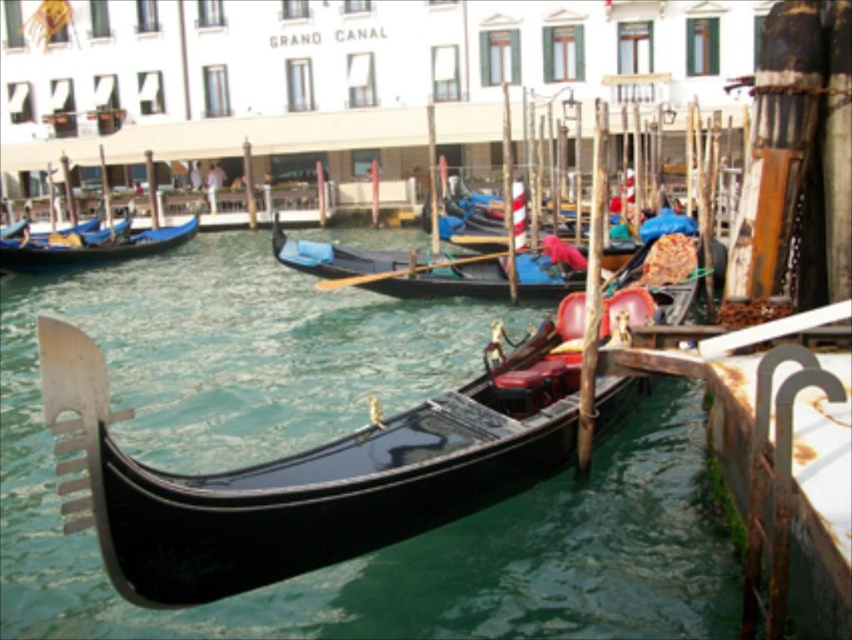
You are standing at the camera position and want to take a photo of the glossy black gondola at center. If your camera has a maximum focus range of 15 meters, will you be able to capture the gondola clearly?

The glossy black gondola at center and camera are 14.46 meters apart from each other, which is within the camera maximum focus range of 15 meters. Therefore, you can capture the gondola clearly.

From the picture: You are a tour guide leading a group along the Grand Canal. You have two gondolas available for a short ride. The first is the glossy black gondola at center, and the second is the black polished gondola at center. Your group wants to know if they can comfortably walk from one gondola to the other without getting their feet wet. Can they do this?

The distance between the glossy black gondola at center and the black polished gondola at center is 35.87 feet. Since this distance is quite large, the group cannot comfortably walk between them without getting their feet wet as the gap is too wide.

You are a tourist planning to take a ride on one of the gondolas. You want to choose the wider boat for more comfort. Based on the scene, which gondola should you choose between the glossy black gondola at center and the black polished gondola at center?

The glossy black gondola at center might be wider than black polished gondola at center, so you should choose the glossy black gondola at center for more comfort.